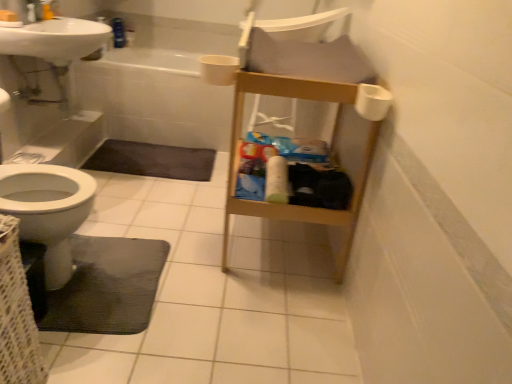
Question: Is white matte toilet paper at upper right, placed as the 2th toilet paper when sorted from bottom to top, to the left of white glossy bathtub at upper center from the viewer's perspective?

Choices:
 (A) yes
 (B) no

Answer: (B)

Question: From the image's perspective, is white matte toilet paper at upper right, placed as the 2th toilet paper when sorted from bottom to top, beneath white glossy bathtub at upper center?

Choices:
 (A) no
 (B) yes

Answer: (B)

Question: Does white matte toilet paper at upper right, the first toilet paper positioned from the front, come in front of white glossy bathtub at upper center?

Choices:
 (A) yes
 (B) no

Answer: (A)

Question: Is white matte toilet paper at upper right, which is the 2th toilet paper from back to front, aimed at white glossy bathtub at upper center?

Choices:
 (A) yes
 (B) no

Answer: (B)

Question: Can you see white matte toilet paper at upper right, which is the 2th toilet paper from back to front, touching white glossy bathtub at upper center?

Choices:
 (A) yes
 (B) no

Answer: (B)

Question: Is black rubber bath mat at lower left, the second bath mat viewed from the top, bigger or smaller than dark gray matte bath mat at lower left, the 1th bath mat in the back-to-front sequence?

Choices:
 (A) big
 (B) small

Answer: (A)

Question: From the image's perspective, is black rubber bath mat at lower left, which is the 1th bath mat in front-to-back order, above or below dark gray matte bath mat at lower left, the 1th bath mat in the back-to-front sequence?

Choices:
 (A) above
 (B) below

Answer: (B)

Question: Considering the relative positions of black rubber bath mat at lower left, the second bath mat viewed from the top, and dark gray matte bath mat at lower left, which appears as the second bath mat when ordered from the bottom, in the image provided, is black rubber bath mat at lower left, the second bath mat viewed from the top, to the left or to the right of dark gray matte bath mat at lower left, which appears as the second bath mat when ordered from the bottom,?

Choices:
 (A) left
 (B) right

Answer: (B)

Question: Is black rubber bath mat at lower left, which is counted as the 1th bath mat, starting from the bottom, situated inside dark gray matte bath mat at lower left, the first bath mat from the top, or outside?

Choices:
 (A) inside
 (B) outside

Answer: (B)

Question: Looking at their shapes, would you say white glossy sink at upper left is wider or thinner than black rubber bath mat at lower left, which is the 1th bath mat in front-to-back order?

Choices:
 (A) wide
 (B) thin

Answer: (B)

Question: Based on their positions, is white glossy sink at upper left located to the left or right of black rubber bath mat at lower left, which is the 2th bath mat in back-to-front order?

Choices:
 (A) left
 (B) right

Answer: (A)

Question: Is white glossy sink at upper left situated inside black rubber bath mat at lower left, which is the 2th bath mat in back-to-front order, or outside?

Choices:
 (A) outside
 (B) inside

Answer: (A)

Question: From a real-world perspective, is white glossy sink at upper left physically located above or below black rubber bath mat at lower left, which is the 2th bath mat in back-to-front order?

Choices:
 (A) above
 (B) below

Answer: (A)

Question: Relative to woven fabric basket at lower left, is white glossy sink at upper left in front or behind?

Choices:
 (A) front
 (B) behind

Answer: (B)

Question: From the image's perspective, relative to woven fabric basket at lower left, is white glossy sink at upper left above or below?

Choices:
 (A) below
 (B) above

Answer: (B)